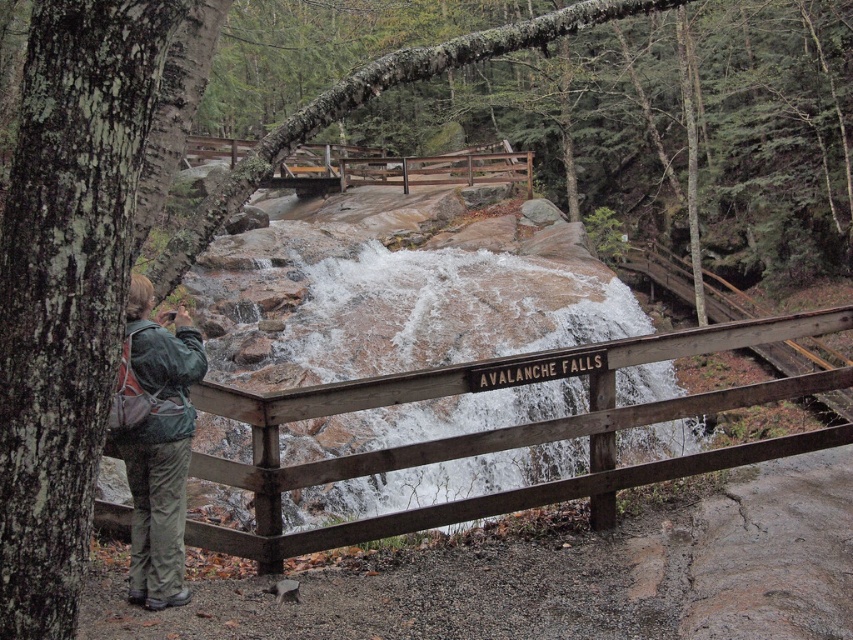
You are standing at the point with coordinates point (368, 179) and want to walk to the wooden sign indicating Avalanche Falls. There is an obstacle at point (728, 448). Will you have to go around the obstacle to reach the sign?

Point (728, 448) is in front of point (368, 179), so yes, you will have to go around the obstacle at point (728, 448) to reach the wooden sign indicating Avalanche Falls.

You are standing at the Avalanche Falls viewpoint and want to take a photo of the wooden fence at center and the green fabric jacket at lower left. Which object is shorter in the image?

The wooden fence at center is shorter than the green fabric jacket at lower left.